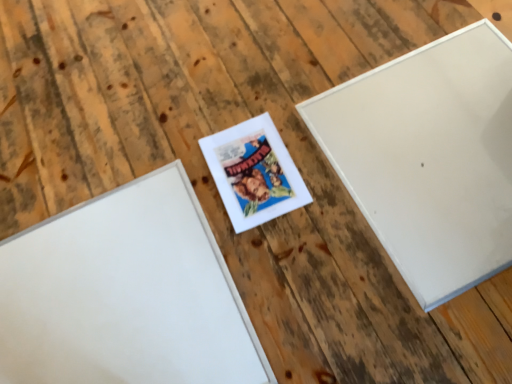
Question: Is white matte picture frame at center, positioned as the 3th picture frame in right-to-left order, taller or shorter than white matte picture frame at upper right, placed as the third picture frame when sorted from left to right?

Choices:
 (A) tall
 (B) short

Answer: (B)

Question: In the image, is white matte picture frame at center, which appears as the 1th picture frame when viewed from the left, positioned in front of or behind white matte picture frame at upper right, placed as the third picture frame when sorted from left to right?

Choices:
 (A) behind
 (B) front

Answer: (B)

Question: Estimate the real-world distances between objects in this image. Which object is closer to the matte white picture frame at center, the second picture frame from the left?

Choices:
 (A) white matte picture frame at center, which appears as the 1th picture frame when viewed from the left
 (B) white matte picture frame at upper right, the first picture frame positioned from the right

Answer: (A)

Question: Estimate the real-world distances between objects in this image. Which object is farther from the matte white picture frame at center, the second picture frame from the left?

Choices:
 (A) white matte picture frame at upper right, the first picture frame positioned from the right
 (B) white matte picture frame at center, positioned as the 3th picture frame in right-to-left order

Answer: (A)